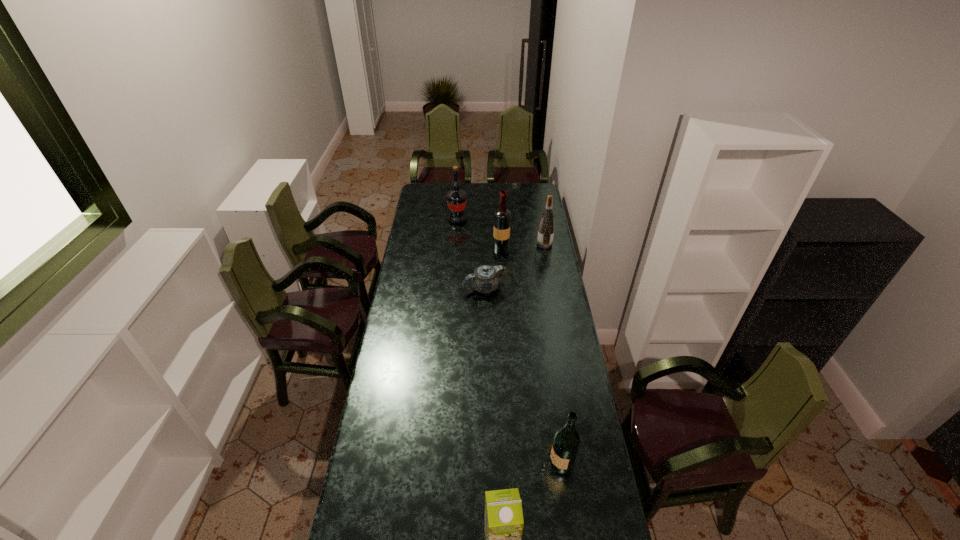
Identify the location of vacant space located from the spout of the chinaware. The height and width of the screenshot is (540, 960). (415, 288).

Locate an element on the screen. The image size is (960, 540). vacant space situated 0.050m from the spout of the chinaware is located at coordinates (453, 288).

Locate an element on the screen. The height and width of the screenshot is (540, 960). free region at the far edge of the desktop is located at coordinates click(x=510, y=196).

I want to click on free spot at the left edge of the desktop, so click(422, 259).

This screenshot has width=960, height=540. In the image, there is a desktop. Identify the location of vacant space at the right edge. (524, 232).

The width and height of the screenshot is (960, 540). I want to click on free region at the far left corner of the desktop, so click(x=431, y=194).

Where is `vacant space at the far right corner of the desktop`? vacant space at the far right corner of the desktop is located at coordinates (539, 194).

You are a GUI agent. You are given a task and a screenshot of the screen. Output one action in this format:
    pyautogui.click(x=<x>, y=<y>)
    Task: Click on the free space between the farthest object and the third wine bottle from right to left
    The height and width of the screenshot is (540, 960).
    Given the screenshot: What is the action you would take?
    pyautogui.click(x=479, y=235)

The width and height of the screenshot is (960, 540). In order to click on free space between the third wine bottle from right to left and the fifth farthest object in this screenshot , I will do `click(528, 355)`.

I want to click on empty space that is in between the second nearest object and the chinaware, so click(x=519, y=375).